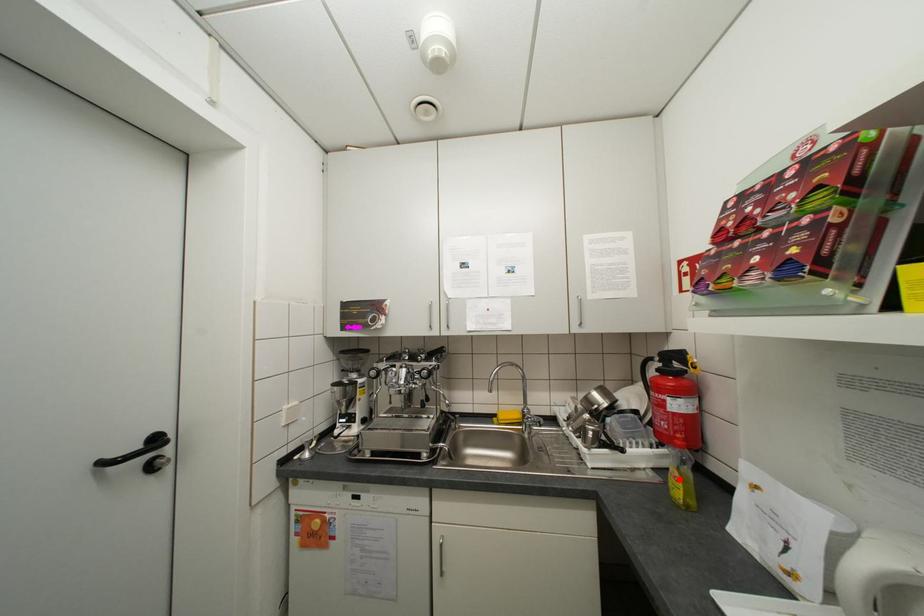
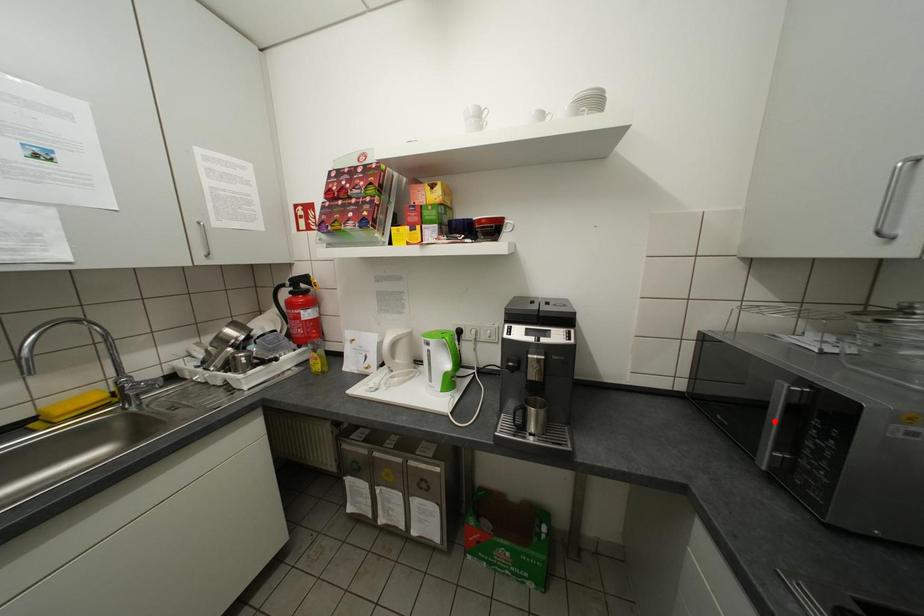
I am providing you with two images of the same scene from different viewpoints. A red point is marked on the first image and another point is marked on the second image. Are the points marked in image1 and image2 representing the same 3D position?

No